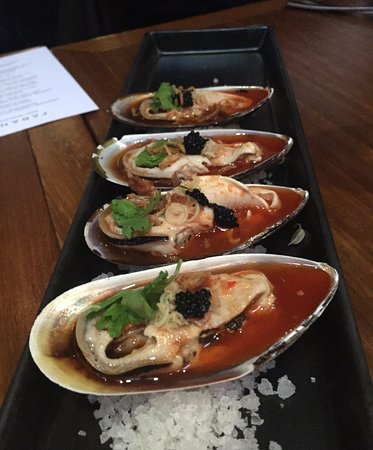
I want to click on plate, so coord(27,419).